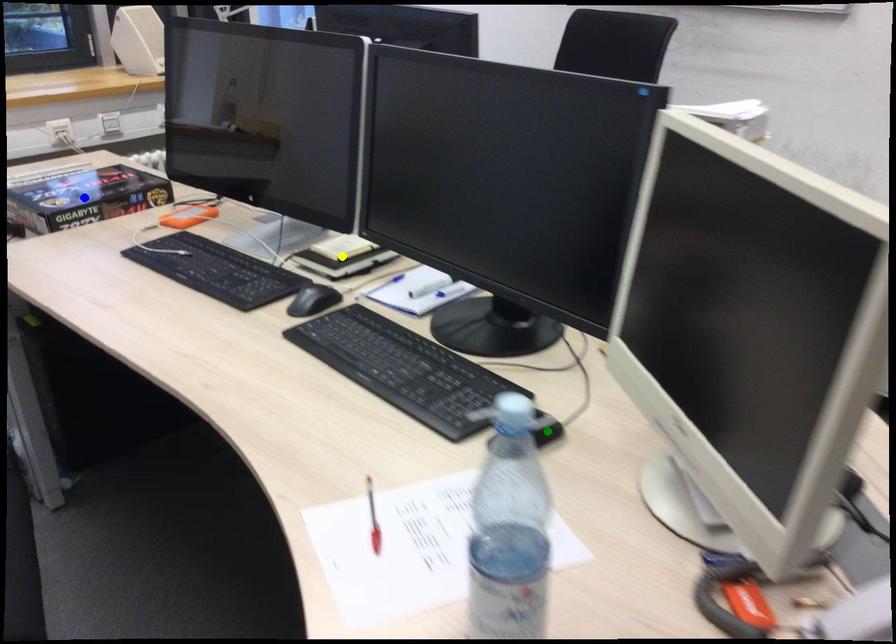
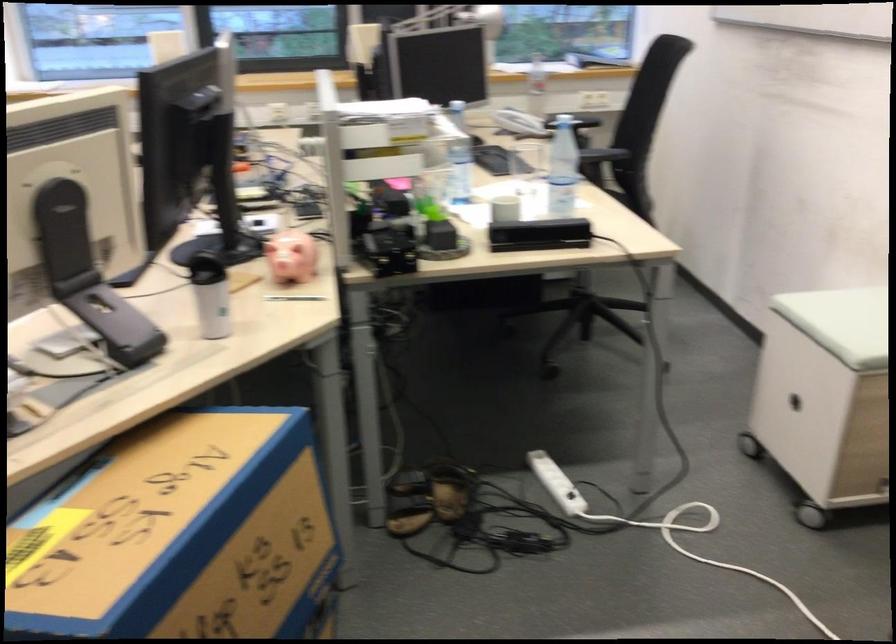
I am providing you with two images of the same scene from different viewpoints. Three points are marked in image1. Which point corresponds to a part or object that is occluded in image2?In image1, three points are marked. Which of them correspond to a part or object that is occluded in image2?Among the three points shown in image1, which one corresponds to a part or object that is no longer visible due to occlusion in image2?

yellow point, blue point, green point cannot be seen in image2.